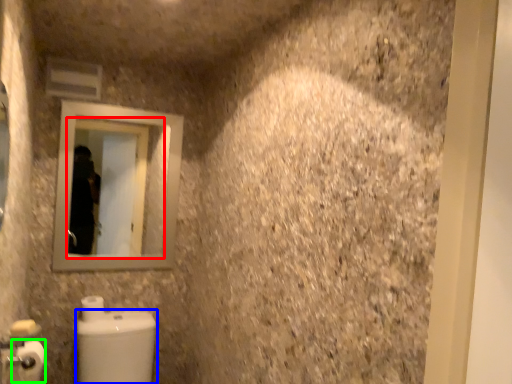
Question: Based on their relative distances, which object is farther from mirror (highlighted by a red box)? Choose from toilet bowl (highlighted by a blue box) and toilet paper (highlighted by a green box).

Choices:
 (A) toilet bowl
 (B) toilet paper

Answer: (B)